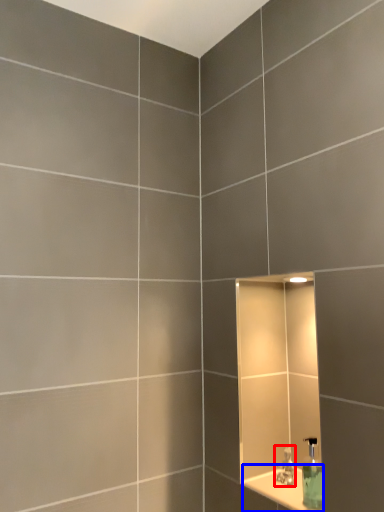
Question: Which object appears farthest to the camera in this image, tap (highlighted by a red box) or ledge (highlighted by a blue box)?

Choices:
 (A) tap
 (B) ledge

Answer: (A)